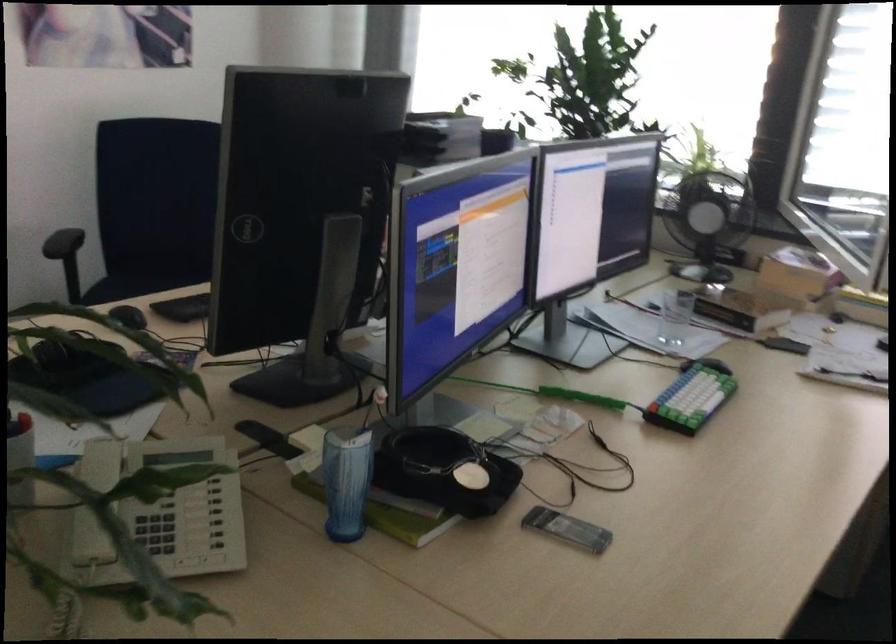
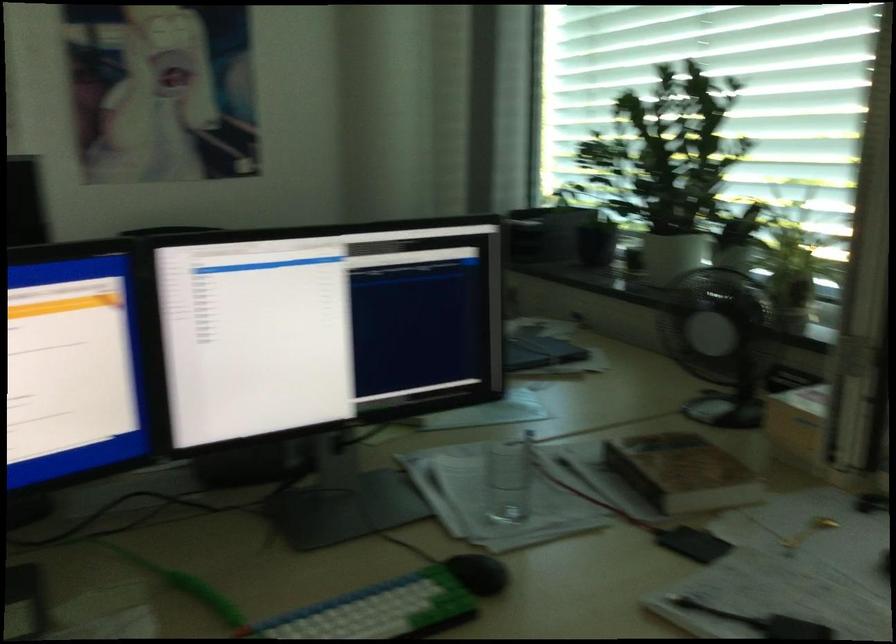
Which direction would the cameraman need to move to produce the second image?

The cameraman walked toward right, forward.